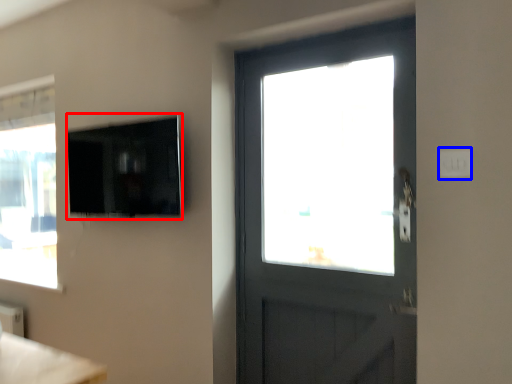
Question: Which point is closer to the camera, window screen (highlighted by a red box) or light switch (highlighted by a blue box)?

Choices:
 (A) window screen
 (B) light switch

Answer: (B)